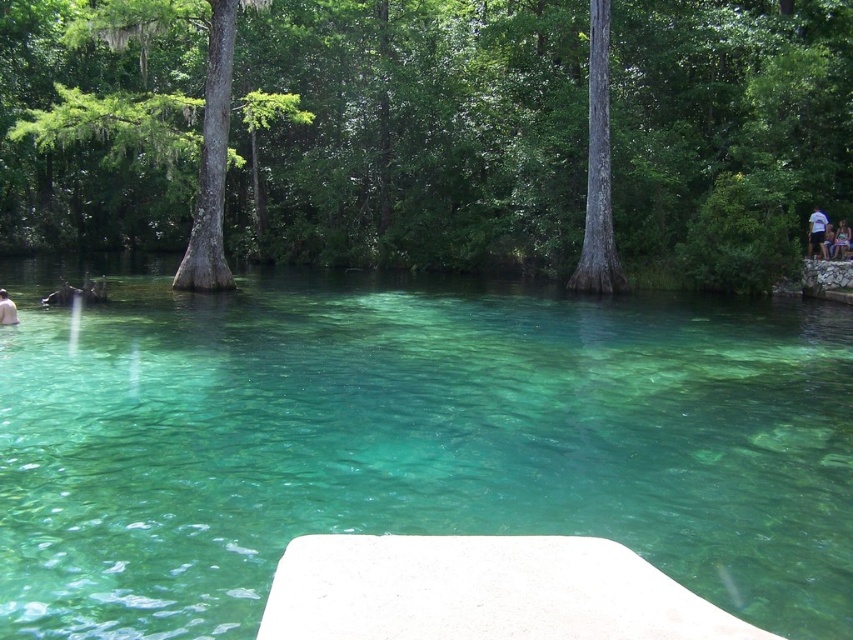
Is light blue denim shorts at right bigger than white matte person at lower left?

Yes.

Is point (849, 236) less distant than point (9, 310)?

No, it is behind (9, 310).

Locate an element on the screen. The height and width of the screenshot is (640, 853). light blue denim shorts at right is located at coordinates (840, 241).

Who is more distant from viewer, (592,3) or (813,228)?

The point (813,228) is behind.

Who is lower down, green matte tree at center or white cotton shirt at upper right?

white cotton shirt at upper right is lower down.

This screenshot has width=853, height=640. What do you see at coordinates (598, 170) in the screenshot? I see `green matte tree at center` at bounding box center [598, 170].

The image size is (853, 640). In order to click on green matte tree at center in this screenshot , I will do `click(598, 170)`.

Is clear glassy water at center positioned before green matte tree at center?

Yes.

Does point (68, 372) come in front of point (605, 284)?

Yes, it is in front of point (605, 284).

Where is `clear glassy water at center`? clear glassy water at center is located at coordinates (409, 438).